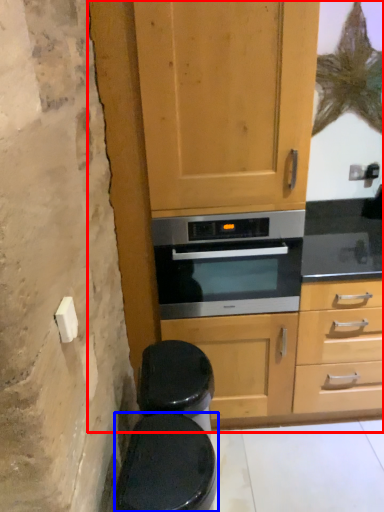
Question: Which object appears farthest to the camera in this image, dresser (highlighted by a red box) or toilet bowl (highlighted by a blue box)?

Choices:
 (A) dresser
 (B) toilet bowl

Answer: (A)